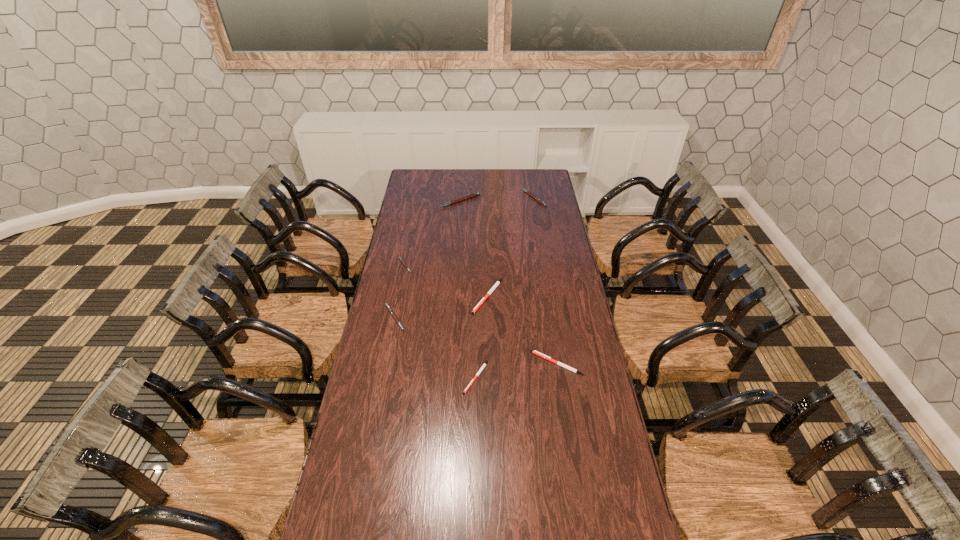
The width and height of the screenshot is (960, 540). Find the location of `free location at the far edge`. free location at the far edge is located at coordinates (451, 181).

The image size is (960, 540). I want to click on vacant area at the left edge of the desktop, so click(x=405, y=241).

At what (x,y) coordinates should I click in order to perform the action: click on vacant space at the right edge of the desktop. Please return your answer as a coordinate pair (x, y). This screenshot has width=960, height=540. Looking at the image, I should click on (598, 381).

Where is `empty space that is in between the third pink pen from left to right and the third farthest pen`? This screenshot has height=540, width=960. empty space that is in between the third pink pen from left to right and the third farthest pen is located at coordinates (433, 233).

What are the coordinates of `empty space between the rightmost white pen and the second smallest pink pen` in the screenshot? It's located at (476, 341).

The image size is (960, 540). Identify the location of unoccupied position between the tallest pen and the third farthest pink pen. (433, 233).

Locate an element on the screen. unoccupied area between the rightmost pink pen and the nearest pink pen is located at coordinates (465, 258).

In order to click on free area in between the second smallest pink pen and the farthest white pen in this screenshot , I will do `click(442, 307)`.

The image size is (960, 540). Identify the location of free space between the nearest pink pen and the third farthest pen. (400, 292).

The height and width of the screenshot is (540, 960). Identify the location of vacant area that lies between the tallest object and the smallest white pen. (468, 289).